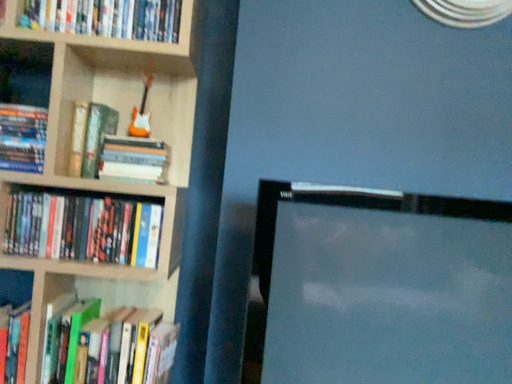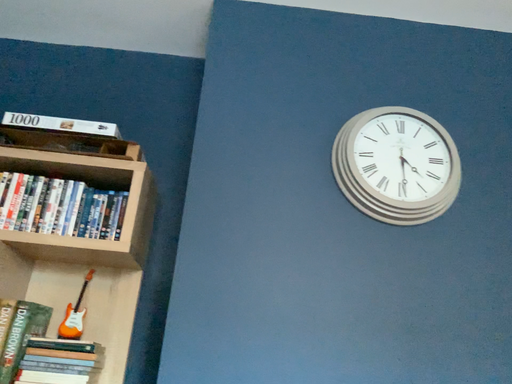
Question: How did the camera likely rotate when shooting the video?

Choices:
 (A) rotated downward
 (B) rotated upward

Answer: (B)